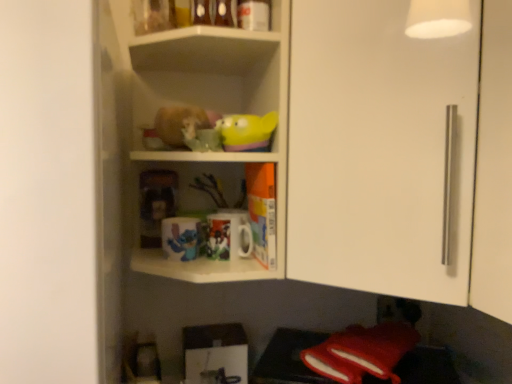
Question: Is glossy ceramic mug at upper center, placed as the first mug when sorted from left to right, further to camera compared to white glossy shelves at upper center?

Choices:
 (A) yes
 (B) no

Answer: (A)

Question: From a real-world perspective, is glossy ceramic mug at upper center, arranged as the second mug when viewed from the right, on top of white glossy shelves at upper center?

Choices:
 (A) yes
 (B) no

Answer: (B)

Question: From a real-world perspective, is glossy ceramic mug at upper center, arranged as the second mug when viewed from the right, physically below white glossy shelves at upper center?

Choices:
 (A) no
 (B) yes

Answer: (B)

Question: Can we say glossy ceramic mug at upper center, arranged as the second mug when viewed from the right, lies outside white glossy shelves at upper center?

Choices:
 (A) yes
 (B) no

Answer: (B)

Question: Is glossy ceramic mug at upper center, placed as the first mug when sorted from left to right, looking in the opposite direction of white glossy shelves at upper center?

Choices:
 (A) yes
 (B) no

Answer: (A)

Question: Does glossy ceramic mug at upper center, arranged as the second mug when viewed from the right, have a larger size compared to white glossy shelves at upper center?

Choices:
 (A) no
 (B) yes

Answer: (A)

Question: From a real-world perspective, is white glossy shelves at upper center on matte plastic toy at center, which appears as the 2th toy when viewed from the front?

Choices:
 (A) no
 (B) yes

Answer: (B)

Question: Considering the relative sizes of white glossy shelves at upper center and matte plastic toy at center, which is counted as the 2th toy, starting from the top, in the image provided, is white glossy shelves at upper center thinner than matte plastic toy at center, which is counted as the 2th toy, starting from the top,?

Choices:
 (A) yes
 (B) no

Answer: (B)

Question: Does white glossy shelves at upper center lie in front of matte plastic toy at center, the 1th toy when ordered from back to front?

Choices:
 (A) no
 (B) yes

Answer: (B)

Question: Could you tell me if white glossy shelves at upper center is turned towards matte plastic toy at center, arranged as the 1th toy when viewed from the left?

Choices:
 (A) yes
 (B) no

Answer: (B)

Question: Is white glossy shelves at upper center further to the viewer compared to matte plastic toy at center, which ranks as the second toy in right-to-left order?

Choices:
 (A) no
 (B) yes

Answer: (A)

Question: Is white glossy shelves at upper center facing away from matte plastic toy at center, the 1th toy when ordered from back to front?

Choices:
 (A) no
 (B) yes

Answer: (B)

Question: Considering the relative sizes of white glossy cabinet door at upper right and rubber duck at upper center, the 1th toy positioned from the top, in the image provided, is white glossy cabinet door at upper right bigger than rubber duck at upper center, the 1th toy positioned from the top,?

Choices:
 (A) no
 (B) yes

Answer: (B)